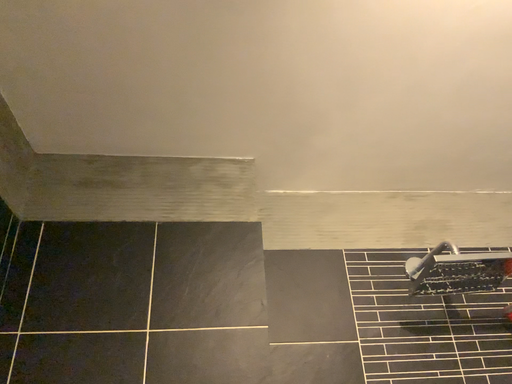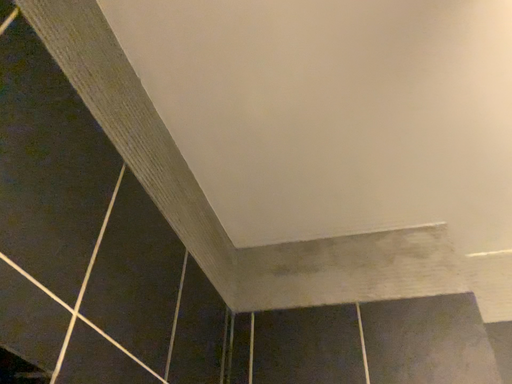
Question: Which way did the camera rotate in the video?

Choices:
 (A) rotated upward
 (B) rotated downward

Answer: (A)